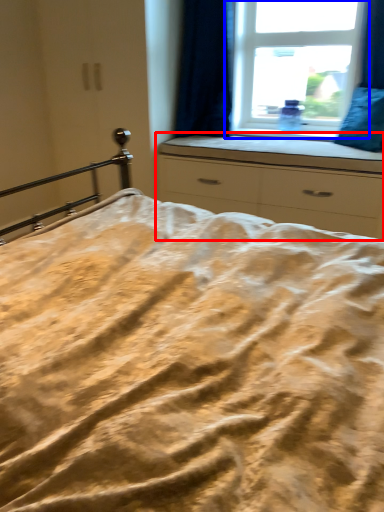
Question: Which of the following is the closest to the observer, chest of drawers (highlighted by a red box) or window (highlighted by a blue box)?

Choices:
 (A) chest of drawers
 (B) window

Answer: (A)